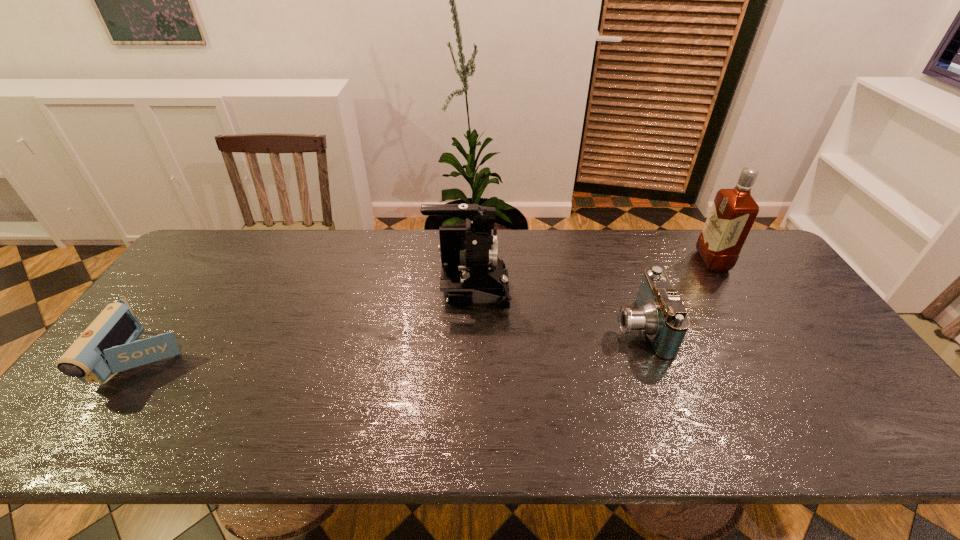
The image size is (960, 540). What are the coordinates of `free space located on the front-facing side of the rightmost camcorder` in the screenshot? It's located at (557, 328).

Where is `vacant area situated on the front-facing side of the rightmost camcorder`? This screenshot has height=540, width=960. vacant area situated on the front-facing side of the rightmost camcorder is located at coordinates (516, 328).

Locate an element on the screen. This screenshot has width=960, height=540. vacant region located on the side of the leftmost object with the flip-out screen is located at coordinates (95, 429).

Identify the location of liquor located in the far edge section of the desktop. 733,212.

I want to click on camcorder located at the far edge, so click(x=471, y=272).

You are a GUI agent. You are given a task and a screenshot of the screen. Output one action in this format:
    pyautogui.click(x=<x>, y=<y>)
    Task: Click on the object located in the left edge section of the desktop
    
    Given the screenshot: What is the action you would take?
    pyautogui.click(x=109, y=345)

I want to click on object situated at the right edge, so click(x=733, y=212).

At what (x,y) coordinates should I click in order to perform the action: click on object positioned at the far right corner. Please return your answer as a coordinate pair (x, y). This screenshot has width=960, height=540. Looking at the image, I should click on point(733,212).

Locate an element on the screen. free region at the far edge of the desktop is located at coordinates (604, 274).

In order to click on free spot at the near edge of the desktop in this screenshot , I will do `click(624, 444)`.